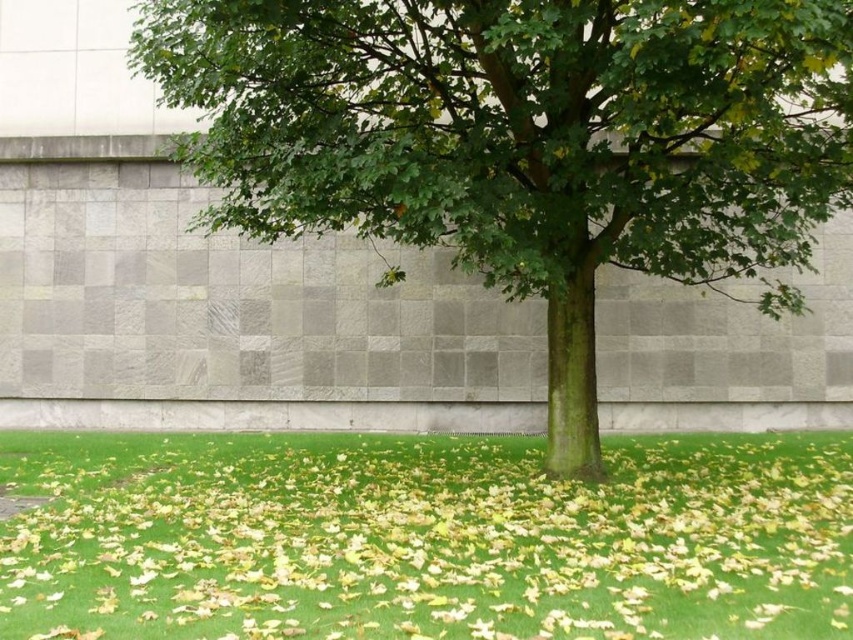
Looking at this image, does green leafy tree at center appear on the left side of green grass at center?

No, green leafy tree at center is not to the left of green grass at center.

Where is `green leafy tree at center`? Image resolution: width=853 pixels, height=640 pixels. green leafy tree at center is located at coordinates (523, 141).